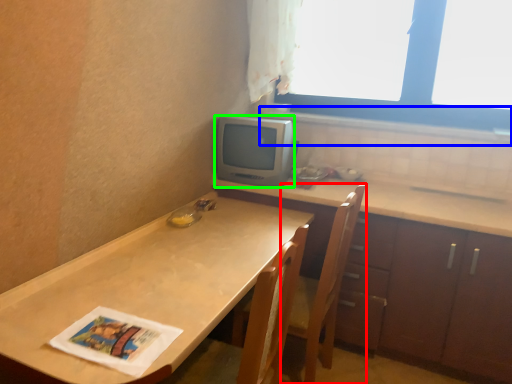
Question: Which object is positioned farthest from chair (highlighted by a red box)? Select from window sill (highlighted by a blue box) and appliance (highlighted by a green box).

Choices:
 (A) window sill
 (B) appliance

Answer: (A)